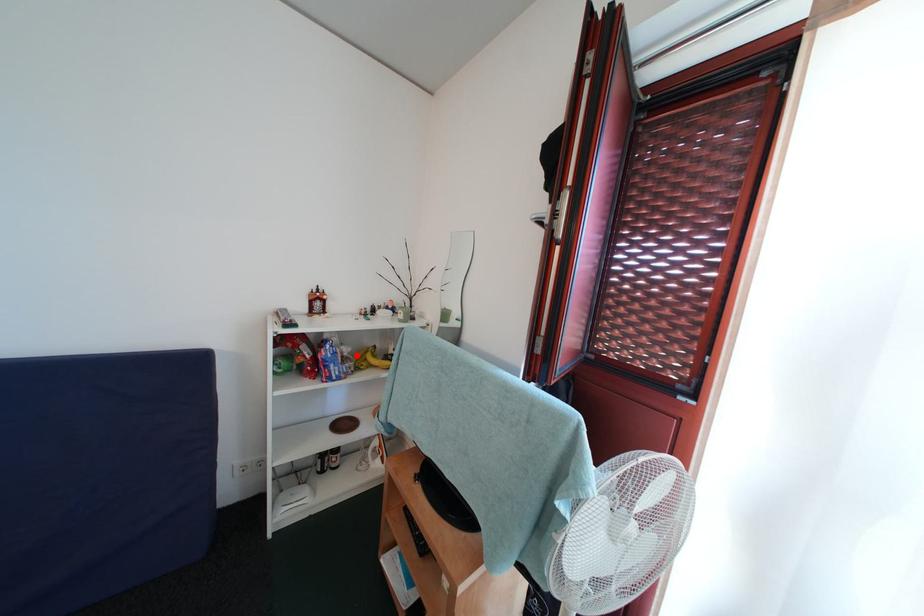
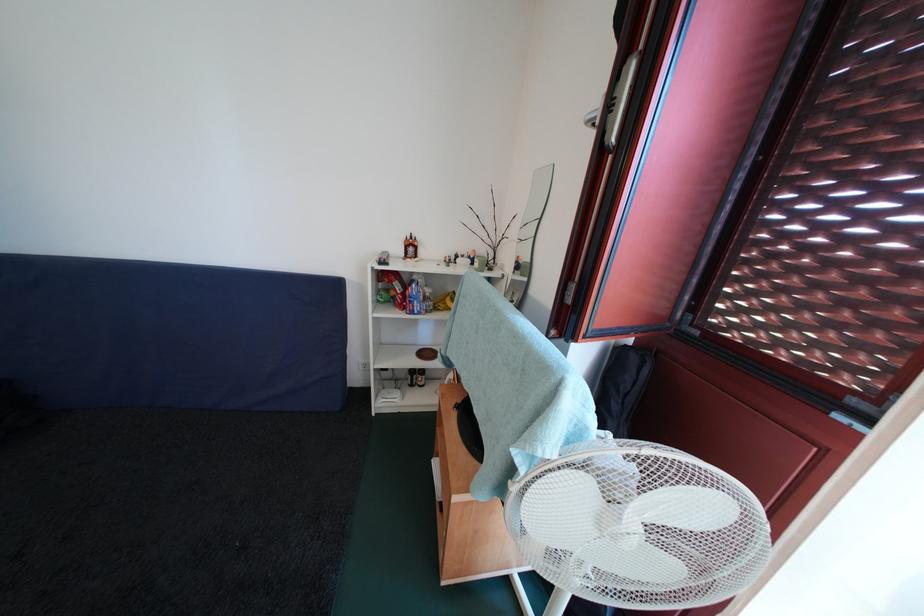
Find the pixel in the second image that matches the highlighted location in the first image.

(438, 296)